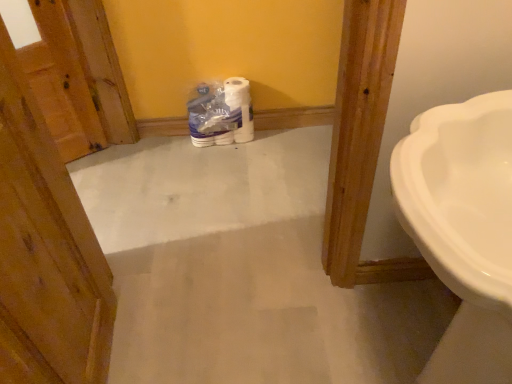
What are the coordinates of `vacant space in front of white glossy toilet paper at center` in the screenshot? It's located at (220, 162).